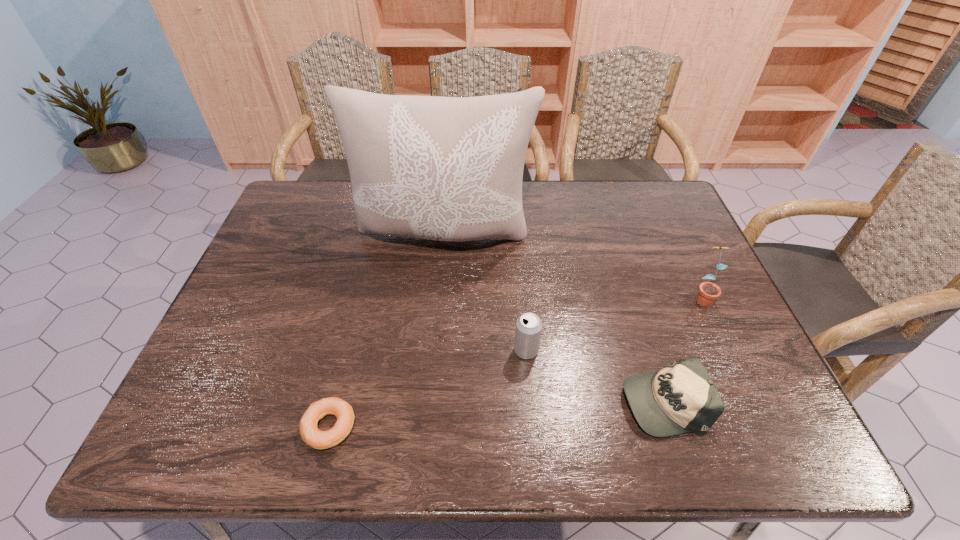
The width and height of the screenshot is (960, 540). Find the location of `vacant position located 0.270m on the flower of the rightmost object`. vacant position located 0.270m on the flower of the rightmost object is located at coordinates (752, 404).

Identify the location of free region located on the back of the beer can. This screenshot has height=540, width=960. (520, 286).

Image resolution: width=960 pixels, height=540 pixels. I want to click on free space located 0.050m on the front-facing side of the baseball cap, so click(599, 401).

Where is `vacant region located on the front-facing side of the baseball cap`? This screenshot has height=540, width=960. vacant region located on the front-facing side of the baseball cap is located at coordinates (498, 401).

Locate an element on the screen. The image size is (960, 540). free space located 0.190m on the front-facing side of the baseball cap is located at coordinates (535, 401).

You are a GUI agent. You are given a task and a screenshot of the screen. Output one action in this format:
    pyautogui.click(x=<x>, y=<y>)
    Task: Click on the vacant space situated on the right of the shortest object
    The image size is (960, 540).
    Given the screenshot: What is the action you would take?
    pyautogui.click(x=394, y=427)

This screenshot has width=960, height=540. In order to click on object present at the far edge in this screenshot , I will do `click(450, 169)`.

The image size is (960, 540). Find the location of `baseball cap located in the near edge section of the desktop`. baseball cap located in the near edge section of the desktop is located at coordinates (680, 398).

Locate an element on the screen. The image size is (960, 540). bagel present at the near edge is located at coordinates (311, 435).

Identify the location of sunflower present at the right edge. (708, 292).